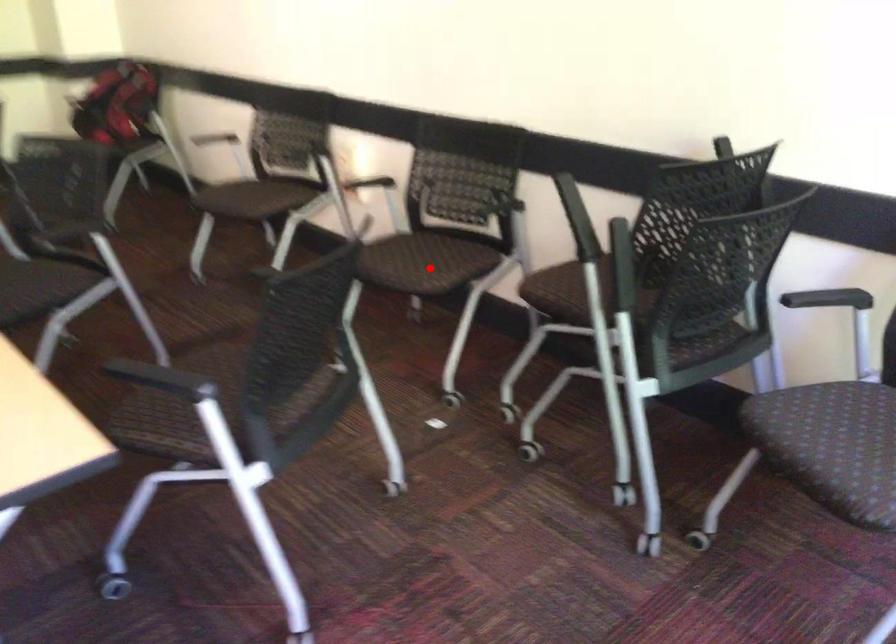
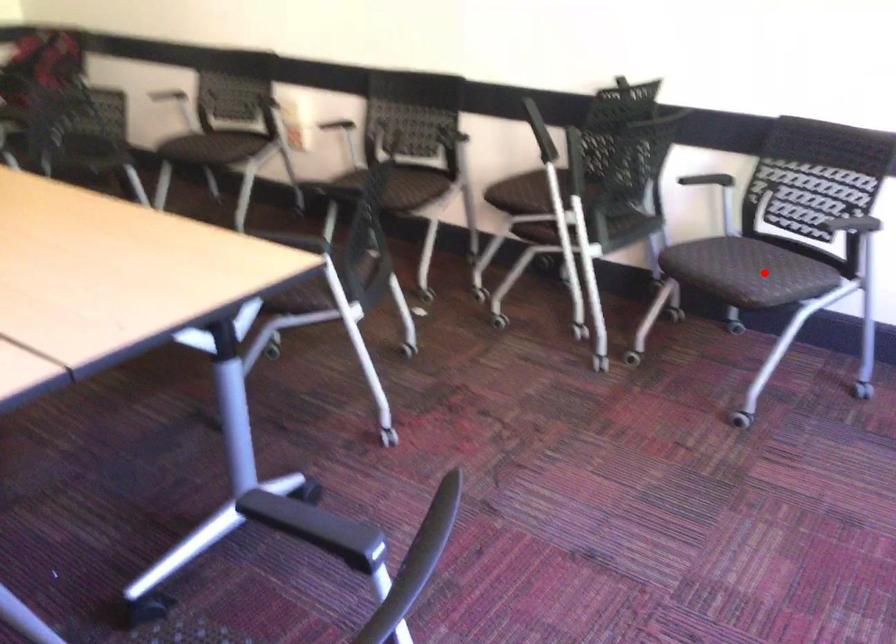
I am providing you with two images of the same scene from different viewpoints. A red point is marked on the first image and another point is marked on the second image. Are the points marked in image1 and image2 representing the same 3D position?

No